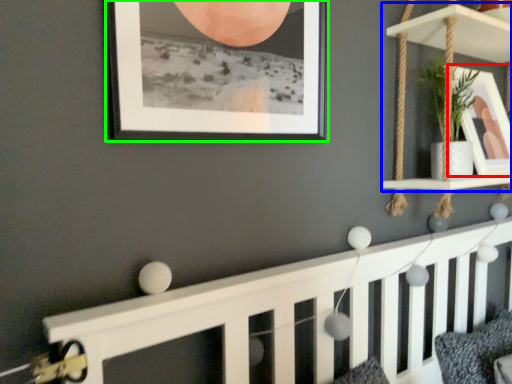
Question: Considering the real-world distances, which object is closest to picture frame (highlighted by a red box)? shelf (highlighted by a blue box) or picture frame (highlighted by a green box).

Choices:
 (A) shelf
 (B) picture frame

Answer: (A)